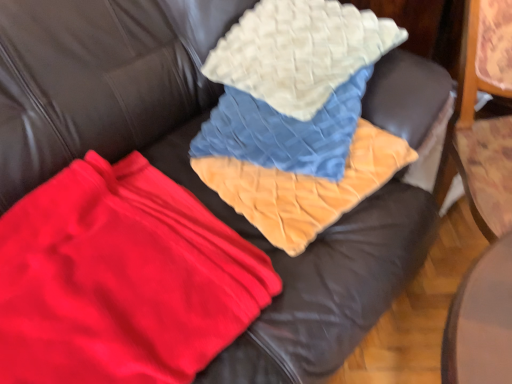
Question: Is velvet orange blanket at center taller or shorter than white quilted pillow at upper center?

Choices:
 (A) tall
 (B) short

Answer: (B)

Question: Is velvet orange blanket at center to the left or to the right of white quilted pillow at upper center in the image?

Choices:
 (A) right
 (B) left

Answer: (B)

Question: Which of these objects is positioned closest to the velvet orange blanket at center?

Choices:
 (A) white quilted pillow at upper center
 (B) red fleece blanket at center

Answer: (A)

Question: Which is farther from the white quilted pillow at upper center?

Choices:
 (A) velvet orange blanket at center
 (B) red fleece blanket at center

Answer: (B)